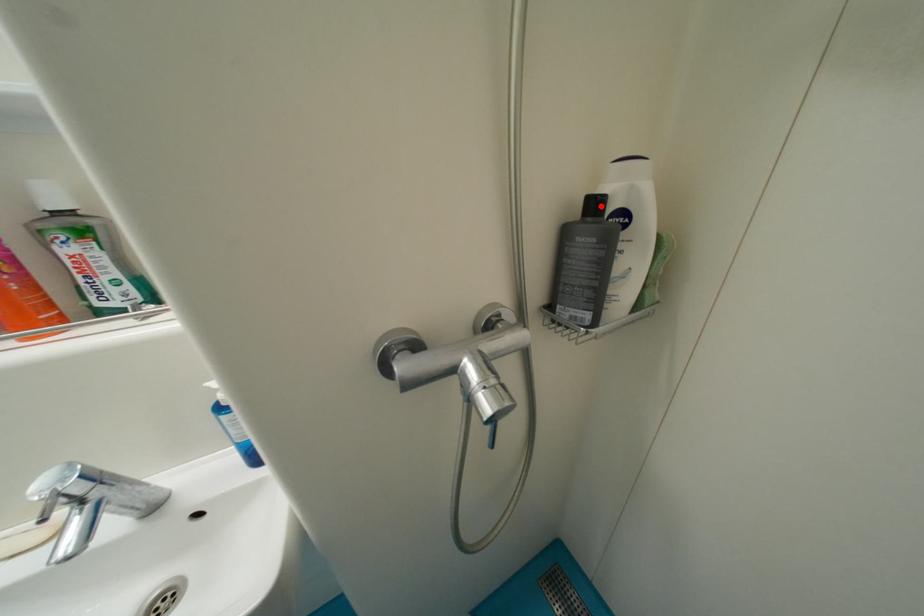
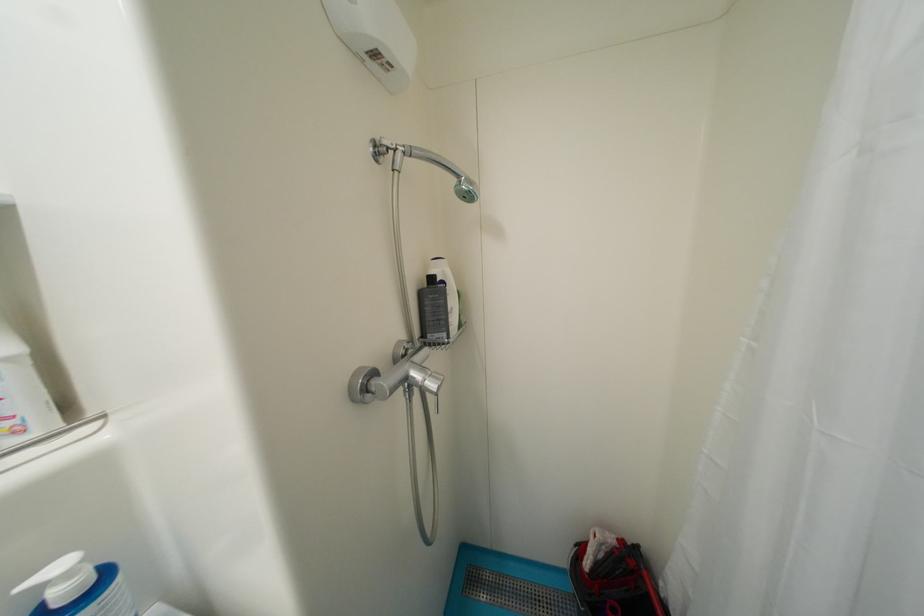
Where in the second image is the point corresponding to the highlighted location from the first image?

(439, 281)